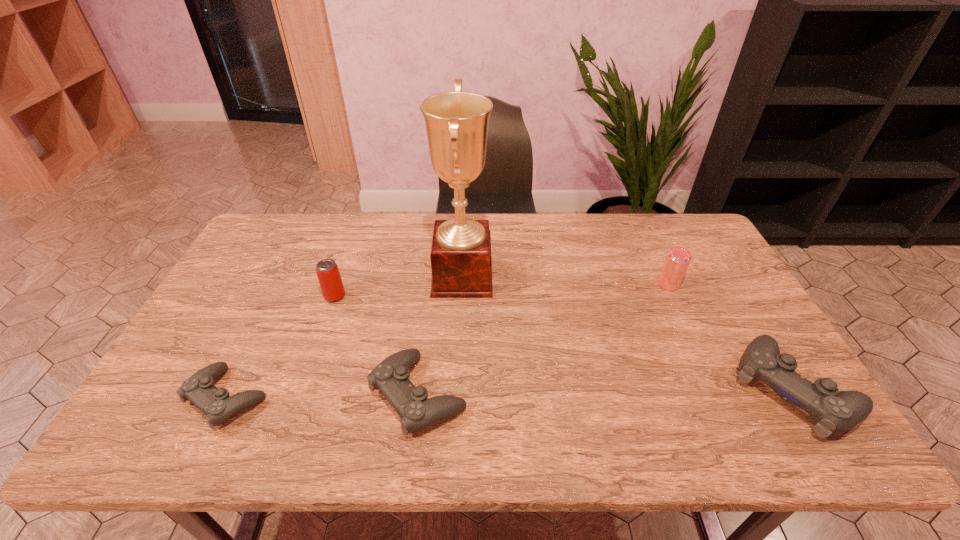
Find the location of `empty space between the tallest object and the fifth object from left to right`. empty space between the tallest object and the fifth object from left to right is located at coordinates (565, 280).

Locate an element on the screen. Image resolution: width=960 pixels, height=540 pixels. vacant point located between the rightmost control and the right beer can is located at coordinates (731, 336).

The height and width of the screenshot is (540, 960). What are the coordinates of `free space between the rightmost control and the second shortest object` in the screenshot? It's located at (606, 392).

This screenshot has width=960, height=540. In order to click on free area in between the tallest control and the tallest object in this screenshot , I will do `click(628, 333)`.

Choose which object is the fifth nearest neighbor to the right beer can. Please provide its 2D coordinates. Your answer should be formatted as a tuple, i.e. [(x, y)], where the tuple contains the x and y coordinates of a point satisfying the conditions above.

[(199, 389)]

Where is `the fourth closest object to the leftmost object`? The width and height of the screenshot is (960, 540). the fourth closest object to the leftmost object is located at coordinates (677, 260).

Identify which control is the third nearest to the tallest object. Please provide its 2D coordinates. Your answer should be formatted as a tuple, i.e. [(x, y)], where the tuple contains the x and y coordinates of a point satisfying the conditions above.

[(833, 412)]

The image size is (960, 540). In order to click on control that is the second closest one to the left beer can in this screenshot , I will do `click(391, 376)`.

Locate an element on the screen. The width and height of the screenshot is (960, 540). vacant region that satisfies the following two spatial constraints: 1. on the plaque of the trophy cup; 2. on the front side of the shortest object is located at coordinates (457, 397).

The width and height of the screenshot is (960, 540). I want to click on vacant region that satisfies the following two spatial constraints: 1. on the plaque of the trophy cup; 2. on the left side of the rightmost object, so click(457, 389).